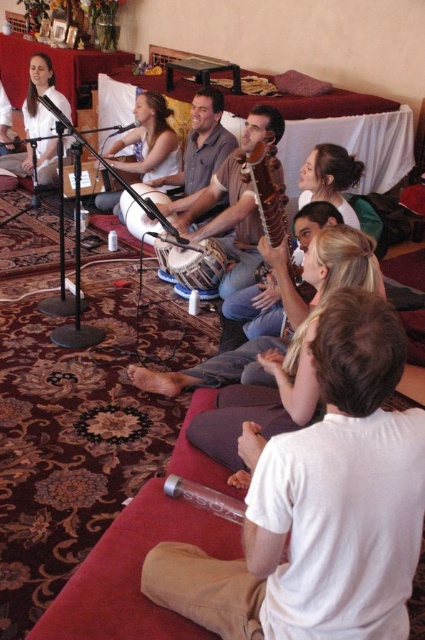
You are standing at the origin point in the room. There are two points marked in the scene, point 1 at coordinates (x=153, y=172) and point 2 at (x=139, y=237). If you want to move from the origin to point 1 and point 2, which point will you reach first?

Point 2 at (x=139, y=237) will be reached first because point 1 at (x=153, y=172) is behind it according to the spatial arrangement described.